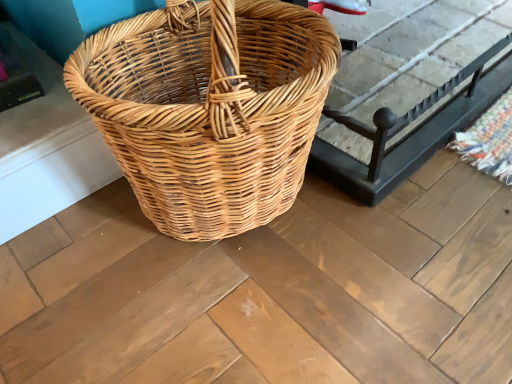
Identify the location of natural wicker basket at center. (410, 132).

Describe the element at coordinates (410, 132) in the screenshot. This screenshot has width=512, height=384. I see `natural wicker basket at center` at that location.

Image resolution: width=512 pixels, height=384 pixels. Describe the element at coordinates (209, 108) in the screenshot. I see `natural wicker picnic basket at center` at that location.

In order to click on natural wicker picnic basket at center in this screenshot , I will do `click(209, 108)`.

Where is `natural wicker basket at center`? natural wicker basket at center is located at coordinates (410, 132).

Is natural wicker picnic basket at center to the left of natural wicker basket at center from the viewer's perspective?

Correct, you'll find natural wicker picnic basket at center to the left of natural wicker basket at center.

Is natural wicker picnic basket at center behind natural wicker basket at center?

No.

Which is closer, (186, 42) or (332, 113)?

The point (186, 42) is more forward.

From the picture: From the image's perspective, is natural wicker picnic basket at center over natural wicker basket at center?

Incorrect, from the image's perspective, natural wicker picnic basket at center is lower than natural wicker basket at center.

From a real-world perspective, is natural wicker picnic basket at center on natural wicker basket at center?

Yes, from a real-world perspective, natural wicker picnic basket at center is over natural wicker basket at center

Does natural wicker picnic basket at center have a lesser width compared to natural wicker basket at center?

Yes.

Which of these two, natural wicker picnic basket at center or natural wicker basket at center, stands taller?

natural wicker picnic basket at center.

Does natural wicker picnic basket at center have a smaller size compared to natural wicker basket at center?

Indeed, natural wicker picnic basket at center has a smaller size compared to natural wicker basket at center.

In the scene shown: Is natural wicker picnic basket at center surrounding natural wicker basket at center?

That's incorrect, natural wicker basket at center is not inside natural wicker picnic basket at center.

Are natural wicker picnic basket at center and natural wicker basket at center located far from each other?

No.

Is natural wicker picnic basket at center looking in the opposite direction of natural wicker basket at center?

No, natural wicker picnic basket at center is not facing away from natural wicker basket at center.

This screenshot has width=512, height=384. I want to click on picnic basket above the natural wicker basket at center (from a real-world perspective), so click(x=209, y=108).

Considering the positions of objects natural wicker basket at center and natural wicker picnic basket at center in the image provided, who is more to the left, natural wicker basket at center or natural wicker picnic basket at center?

From the viewer's perspective, natural wicker picnic basket at center appears more on the left side.

Does natural wicker basket at center lie in front of natural wicker picnic basket at center?

No, the depth of natural wicker basket at center is greater than that of natural wicker picnic basket at center.

Is point (455, 102) closer to camera compared to point (194, 59)?

No, it is behind (194, 59).

From the image's perspective, between natural wicker basket at center and natural wicker picnic basket at center, who is located below?

natural wicker picnic basket at center.

From a real-world perspective, is natural wicker basket at center located higher than natural wicker picnic basket at center?

No, from a real-world perspective, natural wicker basket at center is not on top of natural wicker picnic basket at center.

Does natural wicker basket at center have a lesser width compared to natural wicker picnic basket at center?

No.

From the picture: From their relative heights in the image, would you say natural wicker basket at center is taller or shorter than natural wicker picnic basket at center?

In the image, natural wicker basket at center appears to be shorter than natural wicker picnic basket at center.

Is natural wicker basket at center smaller than natural wicker picnic basket at center?

Actually, natural wicker basket at center might be larger than natural wicker picnic basket at center.

Choose the correct answer: Is natural wicker basket at center inside natural wicker picnic basket at center or outside it?

natural wicker basket at center is not enclosed by natural wicker picnic basket at center.

Is natural wicker basket at center far from natural wicker picnic basket at center?

No.

In the scene shown: Is natural wicker basket at center looking in the opposite direction of natural wicker picnic basket at center?

natural wicker basket at center is not turned away from natural wicker picnic basket at center.

What's the angular difference between natural wicker basket at center and natural wicker picnic basket at center's facing directions?

0.000422 degrees separate the facing orientations of natural wicker basket at center and natural wicker picnic basket at center.

Measure the distance from natural wicker basket at center to natural wicker picnic basket at center.

natural wicker basket at center and natural wicker picnic basket at center are 11.88 inches apart from each other.

Find the location of a particular element. The height and width of the screenshot is (384, 512). picnic basket that is on the left side of natural wicker basket at center is located at coordinates (209, 108).

Locate an element on the screen. Image resolution: width=512 pixels, height=384 pixels. picnic basket located below the natural wicker basket at center (from the image's perspective) is located at coordinates (209, 108).

Locate an element on the screen. This screenshot has width=512, height=384. table above the natural wicker picnic basket at center (from the image's perspective) is located at coordinates (410, 132).